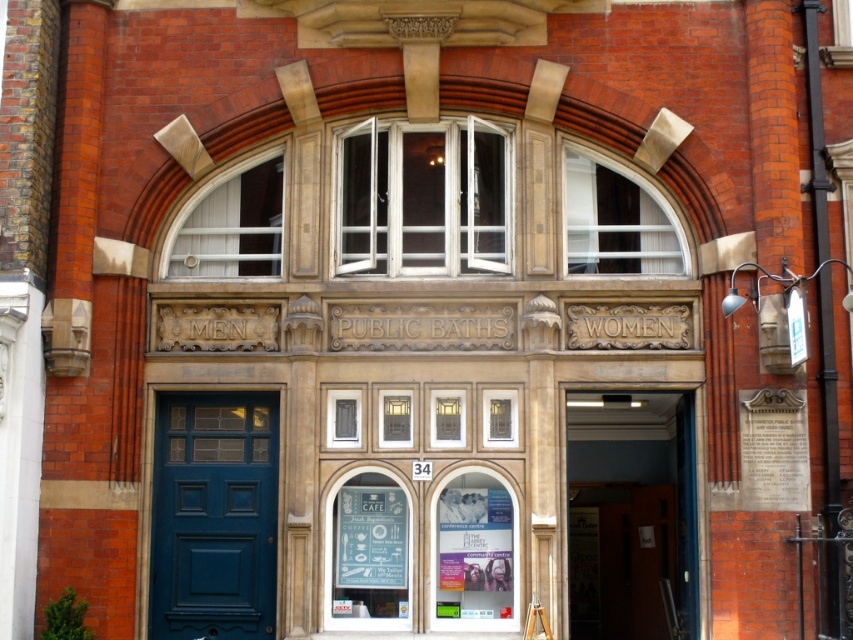
Question: Which point is farther to the camera?

Choices:
 (A) wooden door at center
 (B) blue painted wood door at center

Answer: (B)

Question: Can you confirm if wooden door at center is positioned to the left of blue painted wood door at center?

Choices:
 (A) yes
 (B) no

Answer: (B)

Question: Is wooden door at center below blue painted wood door at center?

Choices:
 (A) no
 (B) yes

Answer: (B)

Question: Which of the following is the farthest from the observer?

Choices:
 (A) (625, 515)
 (B) (259, 481)

Answer: (A)

Question: Observing the image, what is the correct spatial positioning of wooden door at center in reference to blue painted wood door at center?

Choices:
 (A) above
 (B) below

Answer: (B)